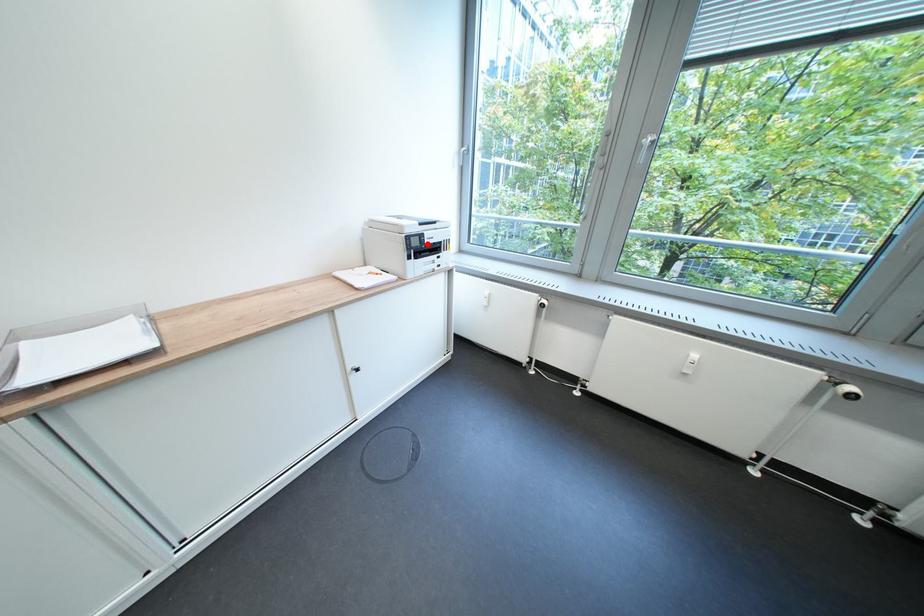
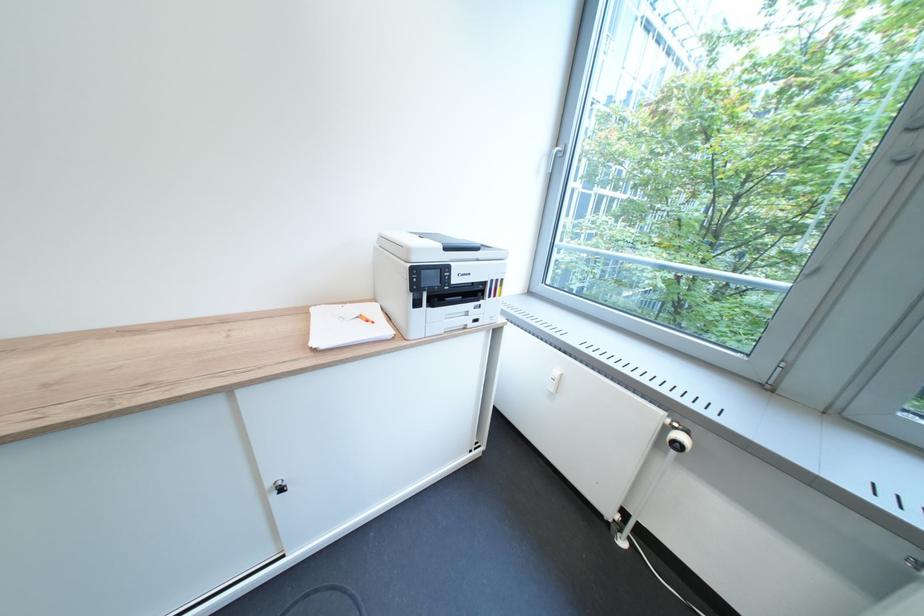
Question: I am providing you with two images of the same scene from different viewpoints. In image1, a red point is highlighted. Considering the same 3D point in image2, which of the following is correct?

Choices:
 (A) It is closer
 (B) It is farther

Answer: (B)